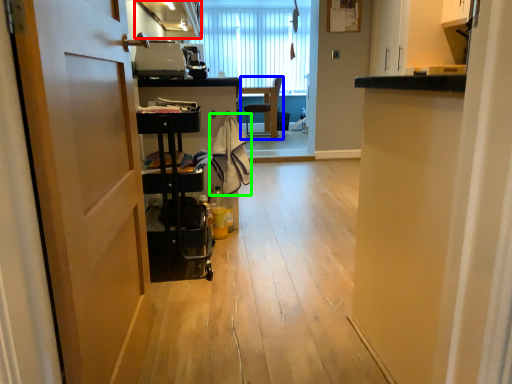
Question: Considering the real-world distances, which object is farthest from cabinetry (highlighted by a red box)? chair (highlighted by a blue box) or laundry (highlighted by a green box)?

Choices:
 (A) chair
 (B) laundry

Answer: (A)